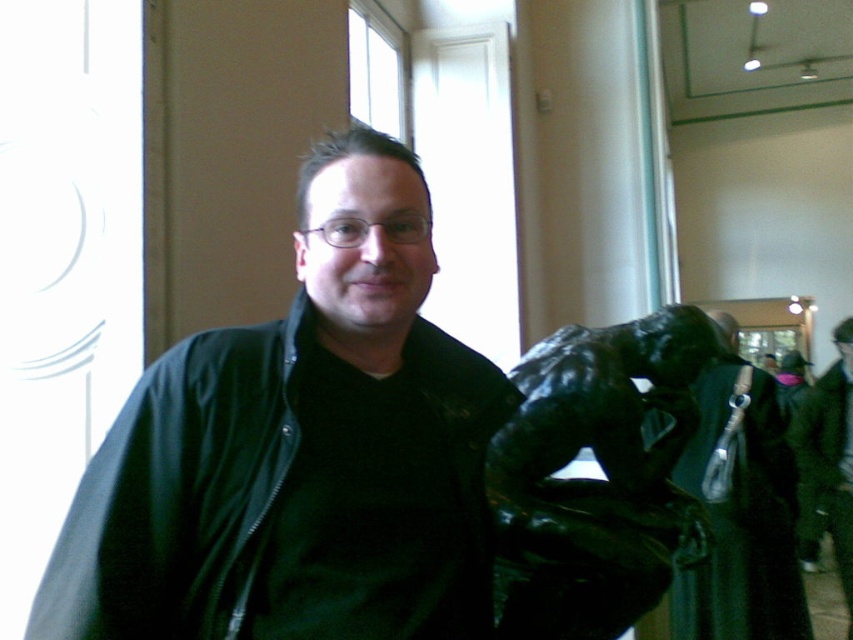
Question: Is black bronze statue at center below black matte jacket at center?

Choices:
 (A) no
 (B) yes

Answer: (A)

Question: Among these points, which one is farthest from the camera?

Choices:
 (A) (498, 413)
 (B) (508, 524)
 (C) (845, 429)

Answer: (C)

Question: Which of the following is the farthest from the observer?

Choices:
 (A) (817, 428)
 (B) (577, 582)

Answer: (A)

Question: Is black bronze statue at center below black matte jacket at center?

Choices:
 (A) yes
 (B) no

Answer: (B)

Question: From the image, what is the correct spatial relationship of green matte jacket at center in relation to black bronze statue at center?

Choices:
 (A) above
 (B) below

Answer: (B)

Question: Which point is farther to the camera?

Choices:
 (A) black bronze statue at center
 (B) green matte jacket at center

Answer: (A)